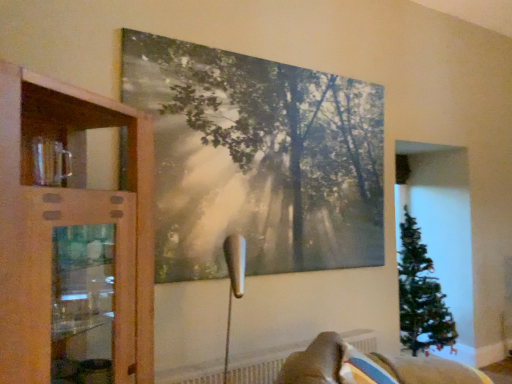
The height and width of the screenshot is (384, 512). I want to click on velvet beige sofa at lower right, so click(x=371, y=367).

Locate an element on the screen. This screenshot has width=512, height=384. wooden cabinet at left is located at coordinates (72, 239).

What is the approximate height of matte canvas painting at upper center?

It is 4.69 feet.

Describe the element at coordinates (261, 365) in the screenshot. This screenshot has width=512, height=384. I see `white textured radiator at lower center` at that location.

Where is `velvet beige sofa at lower right`? The image size is (512, 384). velvet beige sofa at lower right is located at coordinates (371, 367).

Is white textured radiator at lower center to the right of velvet beige sofa at lower right from the viewer's perspective?

No, white textured radiator at lower center is not to the right of velvet beige sofa at lower right.

How far apart are white textured radiator at lower center and velvet beige sofa at lower right?

white textured radiator at lower center is 25.05 inches from velvet beige sofa at lower right.

Consider the image. Is white textured radiator at lower center taller or shorter than velvet beige sofa at lower right?

Clearly, white textured radiator at lower center is shorter compared to velvet beige sofa at lower right.

How different are the orientations of white textured radiator at lower center and velvet beige sofa at lower right in degrees?

white textured radiator at lower center and velvet beige sofa at lower right are facing 45.6 degrees away from each other.

Is matte canvas painting at upper center positioned in front of velvet beige sofa at lower right?

No, matte canvas painting at upper center is further to the viewer.

Is matte canvas painting at upper center far away from velvet beige sofa at lower right?

Absolutely, matte canvas painting at upper center is distant from velvet beige sofa at lower right.

Does matte canvas painting at upper center contain velvet beige sofa at lower right?

No, matte canvas painting at upper center does not contain velvet beige sofa at lower right.

Looking at this image, can you confirm if matte canvas painting at upper center is positioned to the left of velvet beige sofa at lower right?

Yes.

From the image's perspective, is matte canvas painting at upper center over white textured radiator at lower center?

Yes, from the image's perspective, matte canvas painting at upper center is over white textured radiator at lower center.

Is white textured radiator at lower center at the back of matte canvas painting at upper center?

matte canvas painting at upper center does not have its back to white textured radiator at lower center.

How many degrees apart are the facing directions of matte canvas painting at upper center and white textured radiator at lower center?

The angular difference between matte canvas painting at upper center and white textured radiator at lower center is 0.157 degrees.

Is white textured radiator at lower center a part of matte canvas painting at upper center?

No, white textured radiator at lower center is not inside matte canvas painting at upper center.

Considering the relative sizes of velvet beige sofa at lower right and matte canvas painting at upper center in the image provided, is velvet beige sofa at lower right smaller than matte canvas painting at upper center?

Actually, velvet beige sofa at lower right might be larger than matte canvas painting at upper center.

Which is nearer, [399,363] or [366,212]?

Positioned in front is point [399,363].

From a real-world perspective, is velvet beige sofa at lower right positioned above or below matte canvas painting at upper center?

velvet beige sofa at lower right is situated lower than matte canvas painting at upper center in the real world.

Image resolution: width=512 pixels, height=384 pixels. I want to click on cupboard that is above the velvet beige sofa at lower right (from a real-world perspective), so 72,239.

Is wooden cabinet at left not close to velvet beige sofa at lower right?

Yes, wooden cabinet at left is far from velvet beige sofa at lower right.

Is wooden cabinet at left shorter than velvet beige sofa at lower right?

In fact, wooden cabinet at left may be taller than velvet beige sofa at lower right.

Looking at this image, between matte canvas painting at upper center and wooden cabinet at left, which one has less height?

With less height is wooden cabinet at left.

From the image's perspective, is matte canvas painting at upper center above wooden cabinet at left?

Yes, from the image's perspective, matte canvas painting at upper center is on top of wooden cabinet at left.

What's the angular difference between matte canvas painting at upper center and wooden cabinet at left's facing directions?

The angle between the facing direction of matte canvas painting at upper center and the facing direction of wooden cabinet at left is 40.2 degrees.

Is wooden cabinet at left facing towards white textured radiator at lower center?

No, wooden cabinet at left is not facing towards white textured radiator at lower center.

Which is in front, point (113, 125) or point (180, 380)?

The point (113, 125) is closer.

Is wooden cabinet at left bigger than white textured radiator at lower center?

Yes, wooden cabinet at left is bigger than white textured radiator at lower center.

In order to click on radiator behind the wooden cabinet at left in this screenshot , I will do `click(261, 365)`.

Find the location of a particular element. The image size is (512, 384). furniture above the white textured radiator at lower center (from the image's perspective) is located at coordinates (371, 367).

You are a GUI agent. You are given a task and a screenshot of the screen. Output one action in this format:
    pyautogui.click(x=<x>, y=<y>)
    Task: Click on the furniture located underneath the matte canvas painting at upper center (from a real-world perspective)
    The height and width of the screenshot is (384, 512).
    Given the screenshot: What is the action you would take?
    pyautogui.click(x=371, y=367)

Estimate the real-world distances between objects in this image. Which object is closer to white textured radiator at lower center, matte canvas painting at upper center or velvet beige sofa at lower right?

velvet beige sofa at lower right lies closer to white textured radiator at lower center than the other object.

Considering their positions, is white textured radiator at lower center positioned further to velvet beige sofa at lower right than matte canvas painting at upper center?

Based on the image, matte canvas painting at upper center appears to be further to velvet beige sofa at lower right.

When comparing their distances from matte canvas painting at upper center, does wooden cabinet at left or velvet beige sofa at lower right seem closer?

The object closer to matte canvas painting at upper center is wooden cabinet at left.

When comparing their distances from velvet beige sofa at lower right, does white textured radiator at lower center or wooden cabinet at left seem closer?

white textured radiator at lower center is positioned closer to the anchor velvet beige sofa at lower right.

Considering their positions, is matte canvas painting at upper center positioned further to velvet beige sofa at lower right than wooden cabinet at left?

wooden cabinet at left is further to velvet beige sofa at lower right.

Which object lies nearer to the anchor point matte canvas painting at upper center, velvet beige sofa at lower right or wooden cabinet at left?

Based on the image, wooden cabinet at left appears to be nearer to matte canvas painting at upper center.

Based on their spatial positions, is wooden cabinet at left or white textured radiator at lower center closer to matte canvas painting at upper center?

Among the two, wooden cabinet at left is located nearer to matte canvas painting at upper center.

Looking at this image, when comparing their distances from matte canvas painting at upper center, does white textured radiator at lower center or wooden cabinet at left seem closer?

wooden cabinet at left.

The width and height of the screenshot is (512, 384). Identify the location of radiator between wooden cabinet at left and velvet beige sofa at lower right. (261, 365).

Locate an element on the screen. Image resolution: width=512 pixels, height=384 pixels. furniture between matte canvas painting at upper center and white textured radiator at lower center from top to bottom is located at coordinates (371, 367).

Image resolution: width=512 pixels, height=384 pixels. I want to click on cupboard between matte canvas painting at upper center and white textured radiator at lower center in the up-down direction, so [72, 239].

At what (x,y) coordinates should I click in order to perform the action: click on picture frame between wooden cabinet at left and velvet beige sofa at lower right from left to right. Please return your answer as a coordinate pair (x, y). The image size is (512, 384). Looking at the image, I should click on (257, 160).